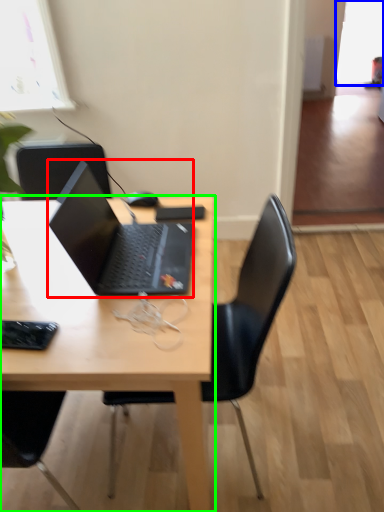
Question: Estimate the real-world distances between objects in this image. Which object is farther from laptop (highlighted by a red box), window screen (highlighted by a blue box) or desk (highlighted by a green box)?

Choices:
 (A) window screen
 (B) desk

Answer: (A)